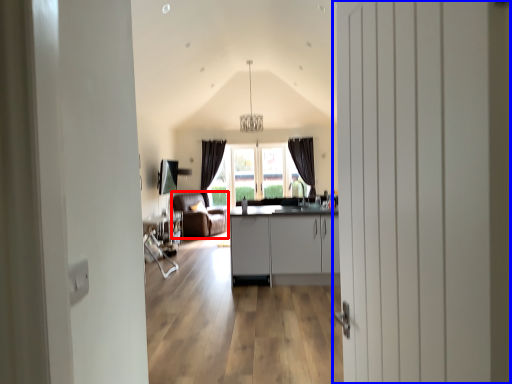
Question: Which object appears farthest to the camera in this image, armchair (highlighted by a red box) or door (highlighted by a blue box)?

Choices:
 (A) armchair
 (B) door

Answer: (A)